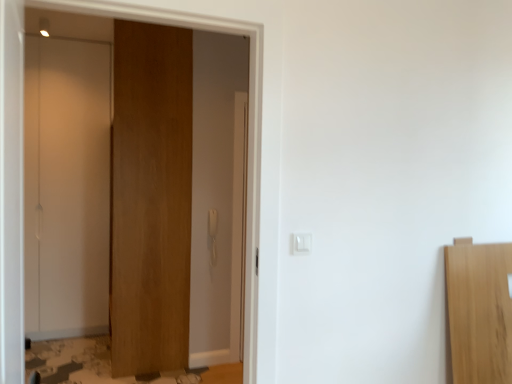
Question: From a real-world perspective, is white glossy door at left, which ranks as the first door in left-to-right order, physically located above or below white plastic light switch at center?

Choices:
 (A) above
 (B) below

Answer: (A)

Question: Relative to white plastic light switch at center, is white glossy door at left, which ranks as the first door in left-to-right order, in front or behind?

Choices:
 (A) front
 (B) behind

Answer: (B)

Question: Which is farther from the wooden door at center, arranged as the first door when viewed from the right?

Choices:
 (A) white glossy door at left, the second door viewed from the right
 (B) white plastic light switch at center

Answer: (B)

Question: Estimate the real-world distances between objects in this image. Which object is farther from the wooden door at center, arranged as the first door when viewed from the right?

Choices:
 (A) white glossy door at left, the second door viewed from the right
 (B) white plastic light switch at center

Answer: (B)